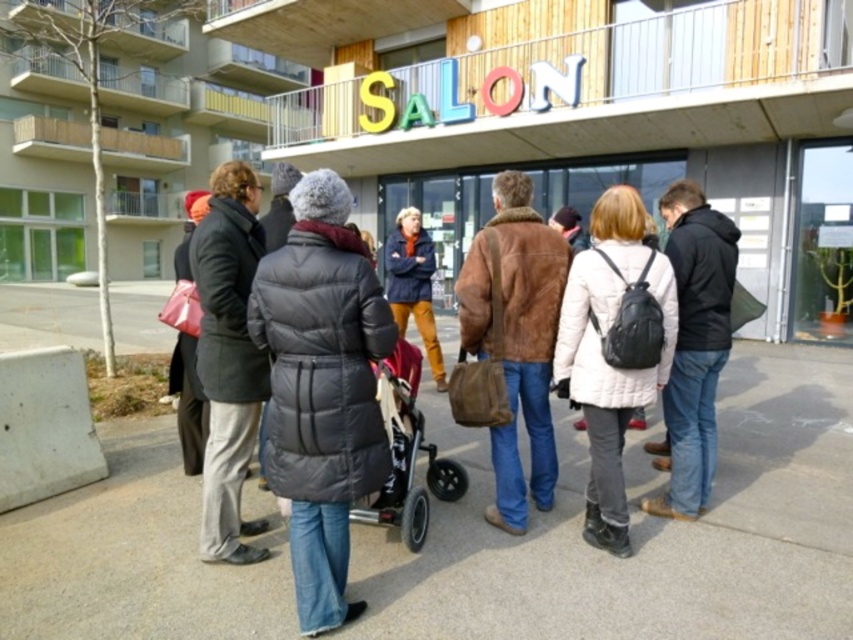
You are a delivery person trying to reach the door of the SALON building. You see the matte black puffer jacket at center and the metallic gray stroller at center in your way. Which object is closer to you, and can you walk around it to reach the door?

The matte black puffer jacket at center is closer to you since it is in front of the metallic gray stroller at center. You can walk around the matte black puffer jacket at center to reach the door.

In the scene shown: You are a delivery person trying to navigate through the crowd in front of the salon. You need to pass between the matte black puffer jacket at center and the metallic gray stroller at center. Considering their sizes, which one should you move closer to in order to have more space to maneuver?

Since the matte black puffer jacket at center occupies less space than the metallic gray stroller at center, you should move closer to the matte black puffer jacket at center to have more space to maneuver.

You are a photographer trying to capture a candid shot of the dark gray puffy jacket at center and the matte blue coat at center. To ensure both are in focus, you need to know their sizes. Which of the two is larger?

The matte blue coat at center is larger than the dark gray puffy jacket at center.